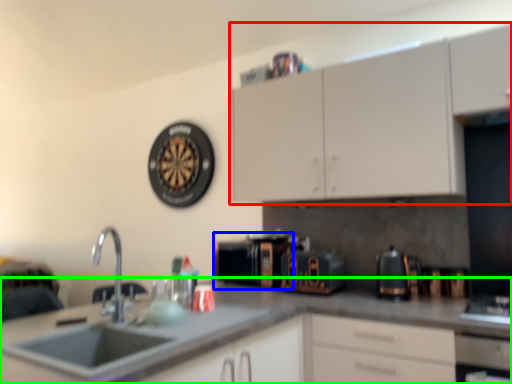
Question: Which is farther away from cabinetry (highlighted by a red box)? appliance (highlighted by a blue box) or countertop (highlighted by a green box)?

Choices:
 (A) appliance
 (B) countertop

Answer: (B)